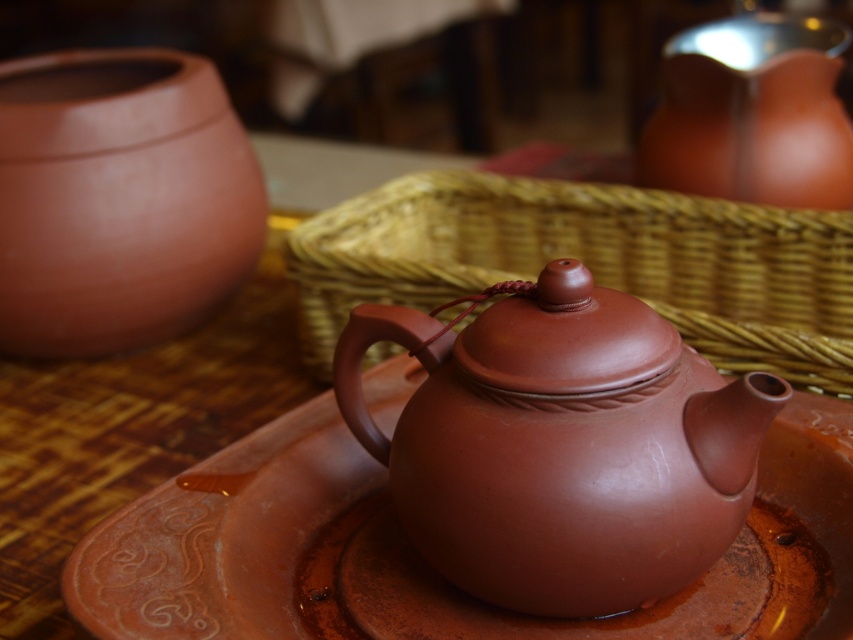
Question: Which object is farther from the camera taking this photo?

Choices:
 (A) matte clay teapot at upper right
 (B) matte clay pot at left
 (C) matte wicker basket at center

Answer: (A)

Question: Can you confirm if matte wicker basket at center is positioned above matte clay pot at left?

Choices:
 (A) no
 (B) yes

Answer: (A)

Question: Among these objects, which one is farthest from the camera?

Choices:
 (A) matte wicker basket at center
 (B) matte clay pot at left
 (C) brown glossy plate at center
 (D) matte clay teapot at center

Answer: (B)

Question: Can you confirm if matte wicker basket at center is positioned above matte clay teapot at upper right?

Choices:
 (A) yes
 (B) no

Answer: (B)

Question: Can you confirm if brown glossy plate at center is positioned to the right of matte clay pot at left?

Choices:
 (A) yes
 (B) no

Answer: (A)

Question: Estimate the real-world distances between objects in this image. Which object is closer to the matte clay pot at left?

Choices:
 (A) matte wicker basket at center
 (B) matte clay teapot at center

Answer: (A)